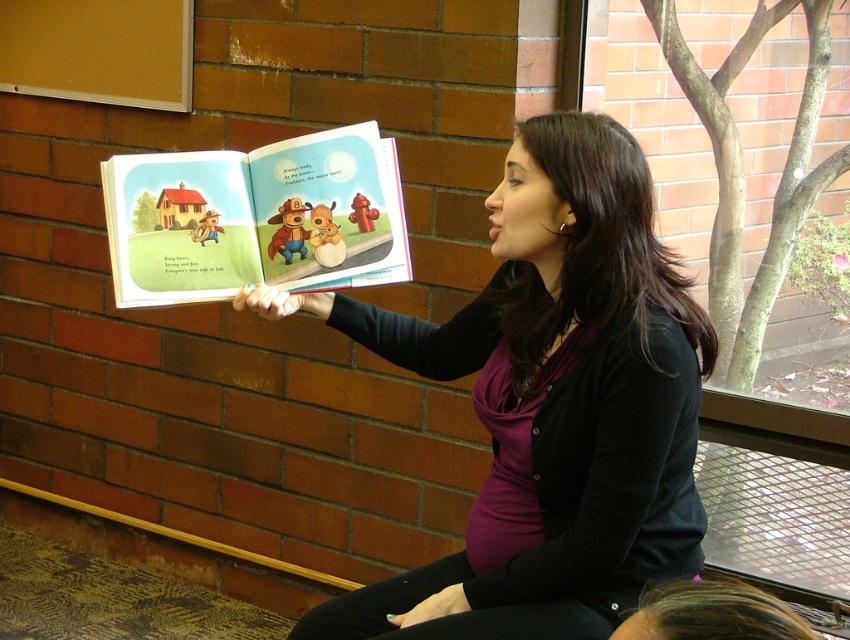
In the scene shown: Is matte black sweater at center above matte paper book at center?

No.

Measure the distance between matte black sweater at center and camera.

A distance of 1.66 meters exists between matte black sweater at center and camera.

Where is `matte black sweater at center`? matte black sweater at center is located at coordinates (550, 403).